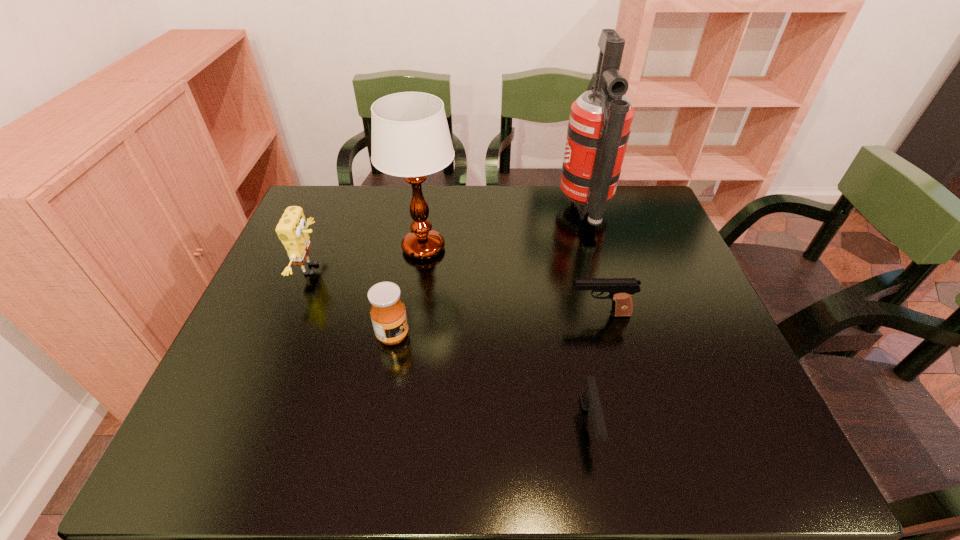
Locate an element on the screen. The image size is (960, 540). fire extinguisher is located at coordinates (600, 121).

Identify the location of table lamp. This screenshot has height=540, width=960. tap(410, 138).

Find the location of `the leftmost object`. the leftmost object is located at coordinates (292, 231).

At what (x,y) coordinates should I click in order to perform the action: click on the fourth shortest object. Please return your answer as a coordinate pair (x, y). The image size is (960, 540). Looking at the image, I should click on (292, 231).

Where is `honey`? Image resolution: width=960 pixels, height=540 pixels. honey is located at coordinates (388, 315).

You are a GUI agent. You are given a task and a screenshot of the screen. Output one action in this format:
    pyautogui.click(x=<x>, y=<y>)
    Task: Click on the fourth tallest object
    
    Given the screenshot: What is the action you would take?
    pyautogui.click(x=388, y=315)

Where is `the farther pistol`? The height and width of the screenshot is (540, 960). the farther pistol is located at coordinates (621, 290).

Locate an element on the screen. the taller pistol is located at coordinates (621, 290).

Identify the location of the shortest object. (590, 400).

You are a GUI agent. You are given a task and a screenshot of the screen. Output one action in this format:
    pyautogui.click(x=<x>, y=<y>)
    Task: Click on the nearest object
    This screenshot has height=540, width=960.
    Given the screenshot: What is the action you would take?
    pyautogui.click(x=590, y=400)